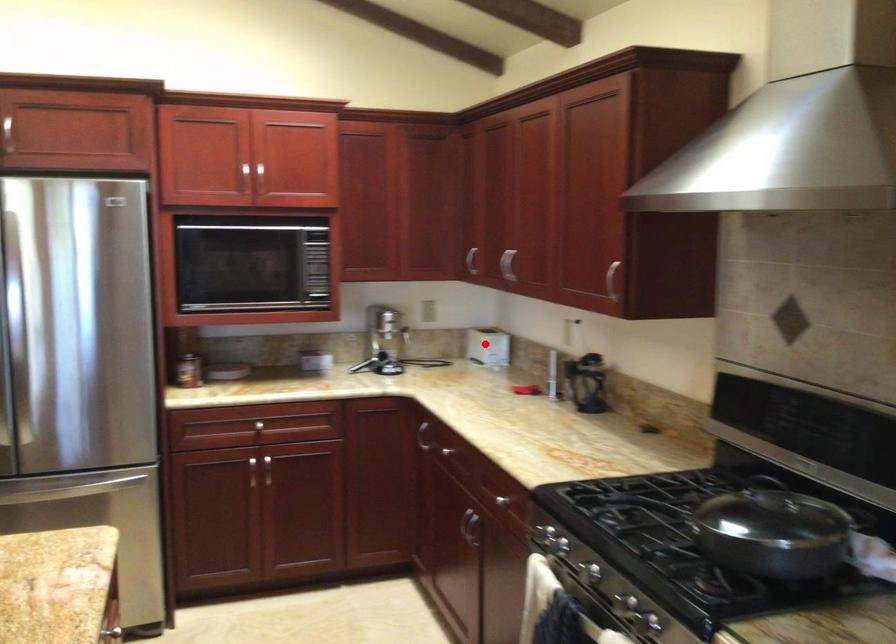
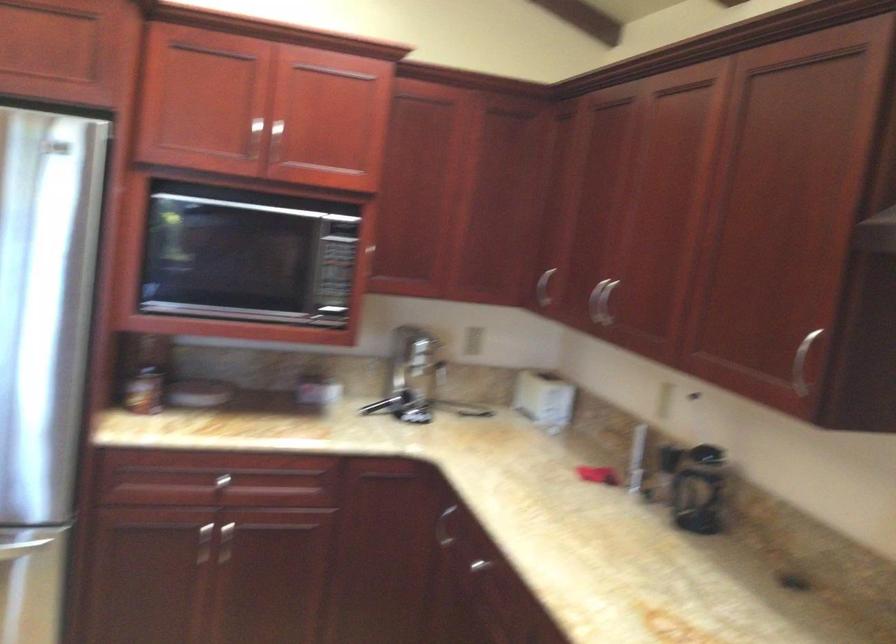
Question: I am providing you with two images of the same scene from different viewpoints. Given a red point in image1, look at the same physical point in image2. Is it:

Choices:
 (A) Closer to the viewpoint
 (B) Farther from the viewpoint

Answer: (A)